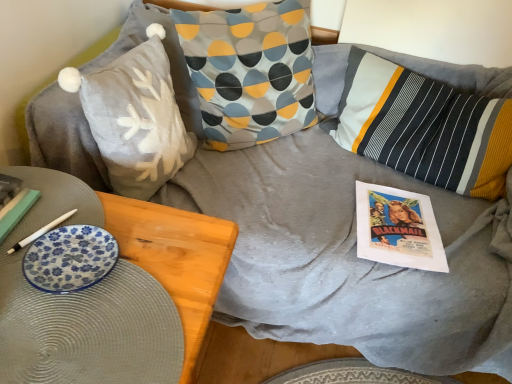
At what (x,y) coordinates should I click in order to perform the action: click on vacant area on top of matte paper comic book at center right (from a real-world perspective). Please return your answer as a coordinate pair (x, y). The height and width of the screenshot is (384, 512). Looking at the image, I should click on (399, 221).